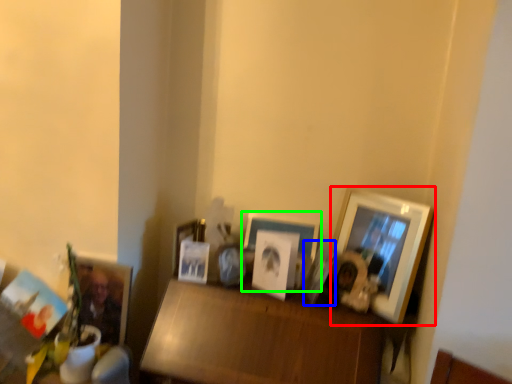
Question: Based on their relative distances, which object is nearer to picture frame (highlighted by a red box)? Choose from picture frame (highlighted by a blue box) and picture frame (highlighted by a green box).

Choices:
 (A) picture frame
 (B) picture frame

Answer: (A)